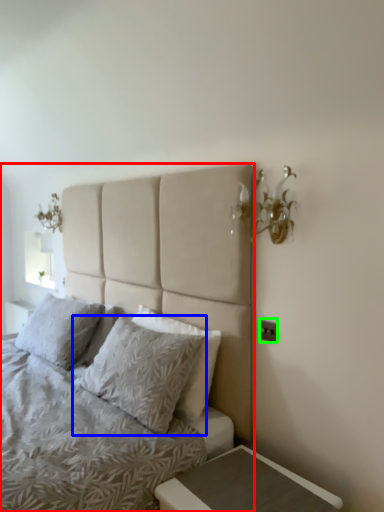
Question: Estimate the real-world distances between objects in this image. Which object is farther from bed (highlighted by a red box), pillow (highlighted by a blue box) or electric outlet (highlighted by a green box)?

Choices:
 (A) pillow
 (B) electric outlet

Answer: (B)